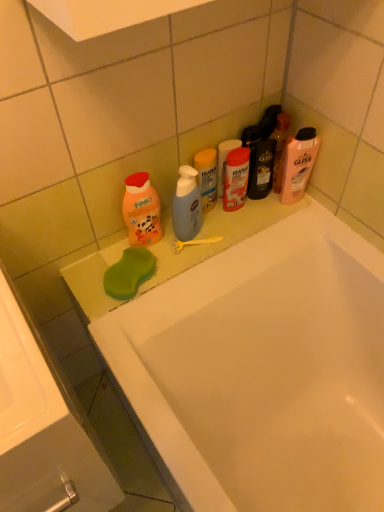
Question: Is orange matte baby soap at left, which is counted as the 3th cleaning product, starting from the right, to the right of white glossy sink at lower left from the viewer's perspective?

Choices:
 (A) yes
 (B) no

Answer: (A)

Question: Is the position of orange matte baby soap at left, which is counted as the 3th cleaning product, starting from the right, less distant than that of white glossy sink at lower left?

Choices:
 (A) yes
 (B) no

Answer: (B)

Question: Is orange matte baby soap at left, which is counted as the 3th cleaning product, starting from the right, not within white glossy sink at lower left?

Choices:
 (A) yes
 (B) no

Answer: (A)

Question: Considering the relative sizes of orange matte baby soap at left, which is counted as the 3th cleaning product, starting from the right, and white glossy sink at lower left in the image provided, is orange matte baby soap at left, which is counted as the 3th cleaning product, starting from the right, thinner than white glossy sink at lower left?

Choices:
 (A) no
 (B) yes

Answer: (B)

Question: Are orange matte baby soap at left, which is counted as the 3th cleaning product, starting from the right, and white glossy sink at lower left making contact?

Choices:
 (A) yes
 (B) no

Answer: (B)

Question: Considering the positions of pink matte shampoo at upper right, the 1th cleaning product positioned from the right, and white glossy sink at lower left in the image, is pink matte shampoo at upper right, the 1th cleaning product positioned from the right, bigger or smaller than white glossy sink at lower left?

Choices:
 (A) big
 (B) small

Answer: (B)

Question: Based on their positions, is pink matte shampoo at upper right, the 1th cleaning product positioned from the right, located to the left or right of white glossy sink at lower left?

Choices:
 (A) right
 (B) left

Answer: (A)

Question: Relative to white glossy sink at lower left, is pink matte shampoo at upper right, the 1th cleaning product positioned from the right, in front or behind?

Choices:
 (A) behind
 (B) front

Answer: (A)

Question: From a real-world perspective, is pink matte shampoo at upper right, marked as the 3th cleaning product in a left-to-right arrangement, physically located above or below white glossy sink at lower left?

Choices:
 (A) above
 (B) below

Answer: (A)

Question: From the image's perspective, relative to white glossy bathtub at upper center, is white glossy sink at lower left above or below?

Choices:
 (A) below
 (B) above

Answer: (B)

Question: Considering their positions, is white glossy sink at lower left located in front of or behind white glossy bathtub at upper center?

Choices:
 (A) behind
 (B) front

Answer: (B)

Question: Considering the positions of white glossy sink at lower left and white glossy bathtub at upper center in the image, is white glossy sink at lower left wider or thinner than white glossy bathtub at upper center?

Choices:
 (A) thin
 (B) wide

Answer: (A)

Question: Is point (18, 504) closer or farther from the camera than point (114, 337)?

Choices:
 (A) closer
 (B) farther

Answer: (A)

Question: Considering the positions of orange matte baby soap at left, which is the first cleaning product in left-to-right order, and translucent plastic bottle at center, the second cleaning product positioned from the right, in the image, is orange matte baby soap at left, which is the first cleaning product in left-to-right order, taller or shorter than translucent plastic bottle at center, the second cleaning product positioned from the right,?

Choices:
 (A) short
 (B) tall

Answer: (B)

Question: Is point (147, 227) closer or farther from the camera than point (208, 206)?

Choices:
 (A) closer
 (B) farther

Answer: (A)